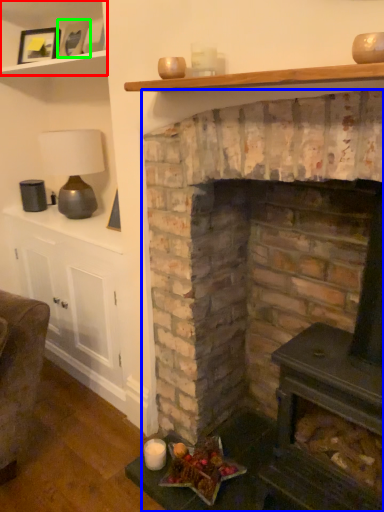
Question: Considering the real-world distances, which object is closest to shelf (highlighted by a red box)? fireplace (highlighted by a blue box) or picture frame (highlighted by a green box).

Choices:
 (A) fireplace
 (B) picture frame

Answer: (B)